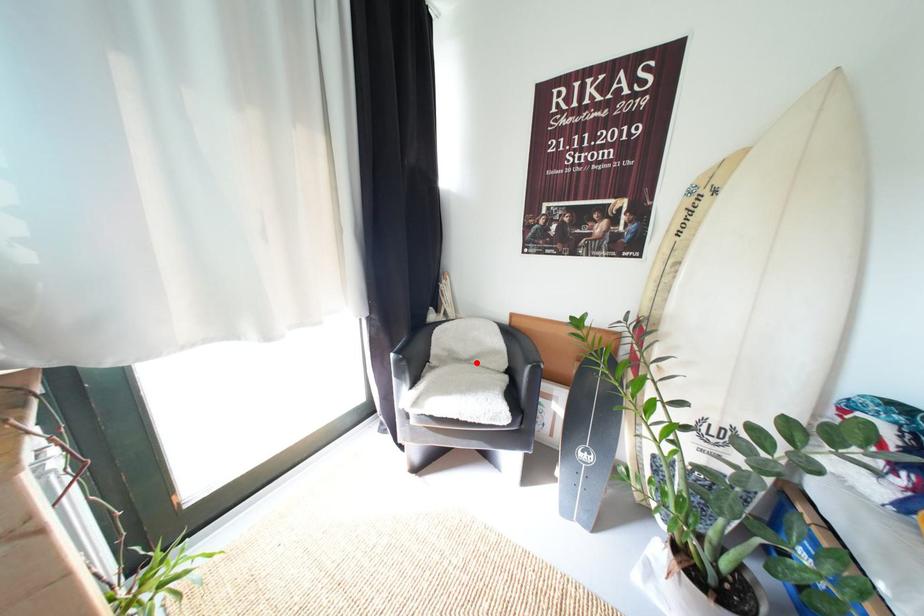
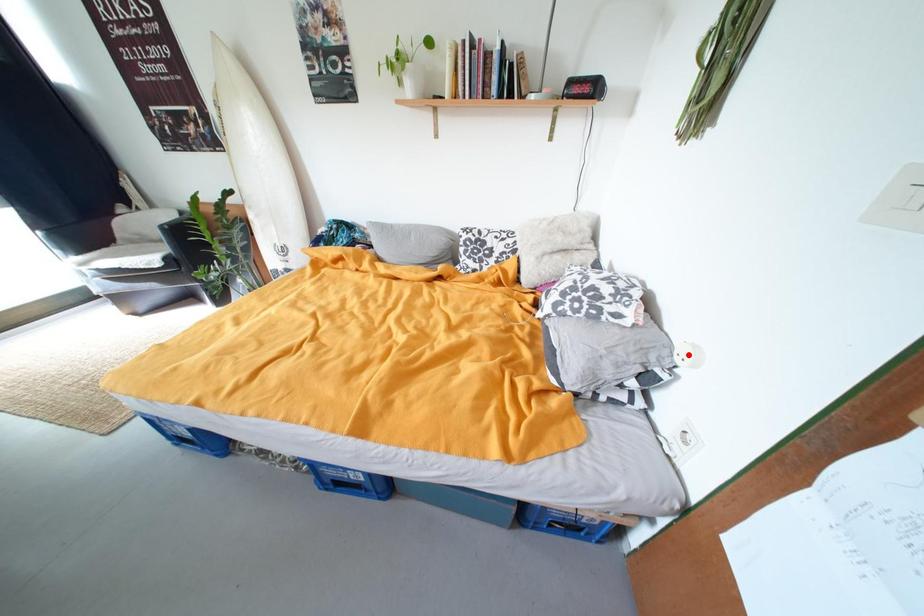
In the scene shown: I am providing you with two images of the same scene from different viewpoints. A red point is marked on the first image and another point is marked on the second image. Is the red point in image1 aligned with the point shown in image2?

No